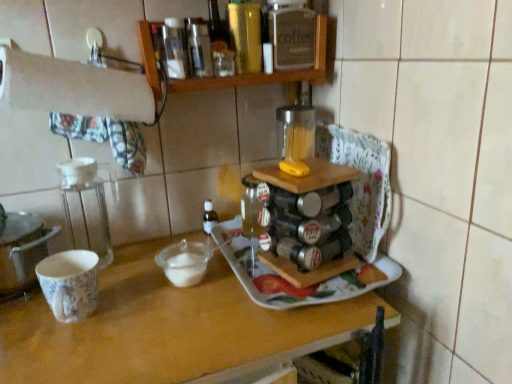
You are a GUI agent. You are given a task and a screenshot of the screen. Output one action in this format:
    pyautogui.click(x=<x>, y=<y>)
    Task: Click on the vacant space behind porcelain floral mug at left
    Image resolution: width=512 pixels, height=384 pixels.
    Given the screenshot: What is the action you would take?
    pyautogui.click(x=127, y=269)